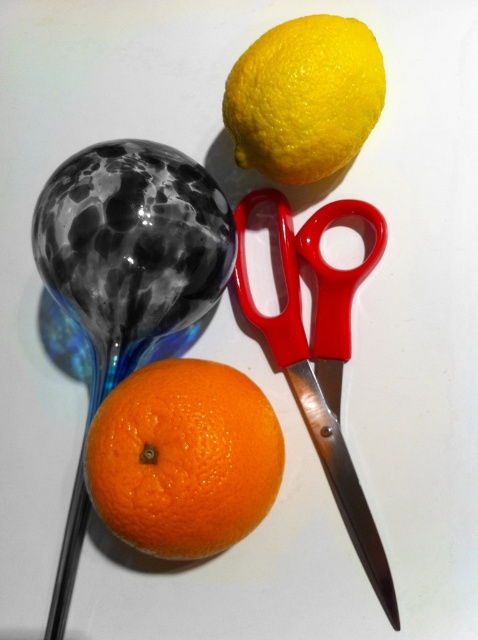
Question: Among these points, which one is farthest from the camera?

Choices:
 (A) click(193, 513)
 (B) click(299, 330)
 (C) click(336, 20)

Answer: (B)

Question: Which point is farther to the camera?

Choices:
 (A) yellow matte lemon at upper center
 (B) red metallic scissors at center

Answer: (A)

Question: Where is orangesmoothorange at center located in relation to red metallic scissors at center in the image?

Choices:
 (A) right
 (B) left

Answer: (B)

Question: Among these objects, which one is farthest from the camera?

Choices:
 (A) yellow matte lemon at upper center
 (B) red metallic scissors at center
 (C) orangesmoothorange at center

Answer: (A)

Question: Can you confirm if orangesmoothorange at center is thinner than red metallic scissors at center?

Choices:
 (A) yes
 (B) no

Answer: (B)

Question: Can you confirm if orangesmoothorange at center is bigger than red metallic scissors at center?

Choices:
 (A) yes
 (B) no

Answer: (B)